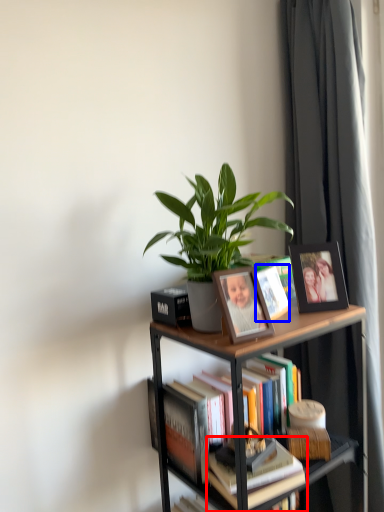
Question: Which object appears closest to the camera in this image, book (highlighted by a red box) or book cover (highlighted by a blue box)?

Choices:
 (A) book
 (B) book cover

Answer: (A)